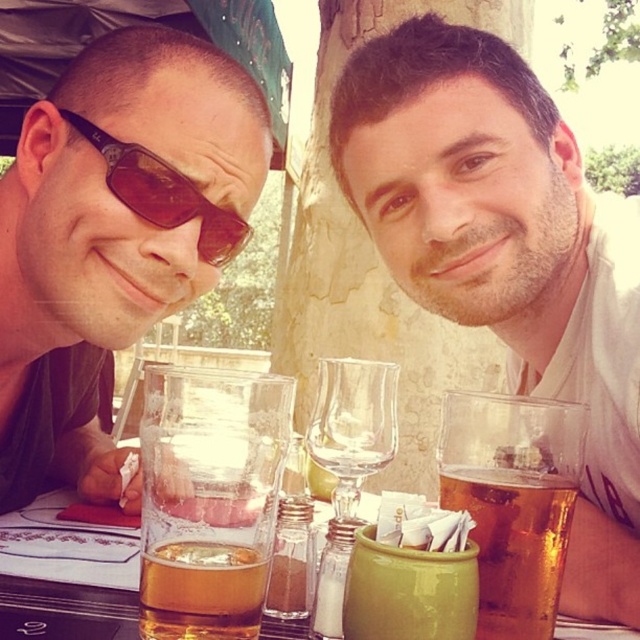
You are a waiter at this outdoor table and need to place two drinks for the customers. The first drink is a translucent glass beer at center, and the second is a translucent glass mug at center. According to the current arrangement, where should you place the beer and mug to match the existing setup?

The translucent glass beer at center should be placed on the left side of the translucent glass mug at center to match the existing setup.

You are sitting at the table and want to reach both the point at (26, 294) and the point at (154, 432). Which point is closer to you?

The point at (26, 294) is closer to you because it is further to the viewer than the point at (154, 432).

You are a photographer taking a picture of the two people at the table. The matte black sunglasses at left are located at point [113,237]. Where should you position your camera to ensure both the sunglasses and the rest of the scene are in focus?

The matte black sunglasses at left are located at point [113,237]. To ensure both the sunglasses and the rest of the scene are in focus, position the camera so the focal point is at the sunglasses, as they are closer to the camera. This will keep both the sunglasses and the background in focus due to the depth of field.